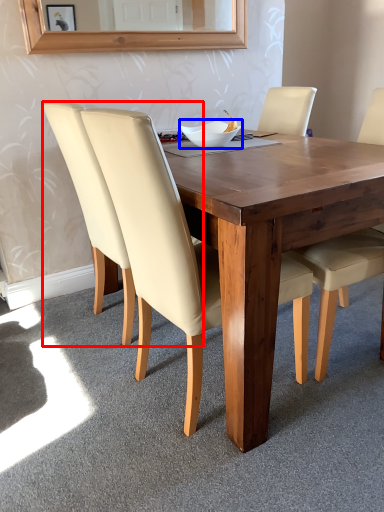
Question: Which of the following is the farthest to the observer, chair (highlighted by a red box) or bowl (highlighted by a blue box)?

Choices:
 (A) chair
 (B) bowl

Answer: (B)